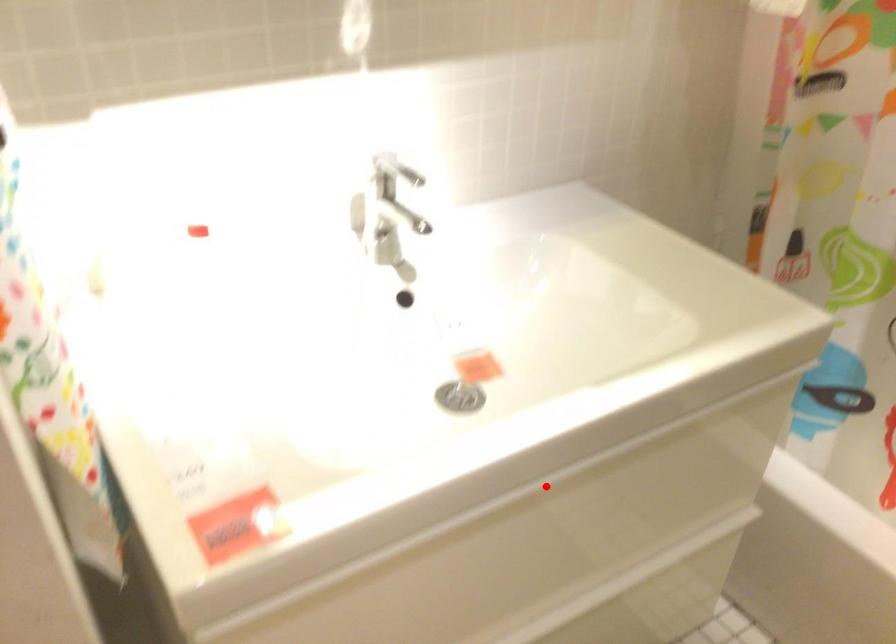
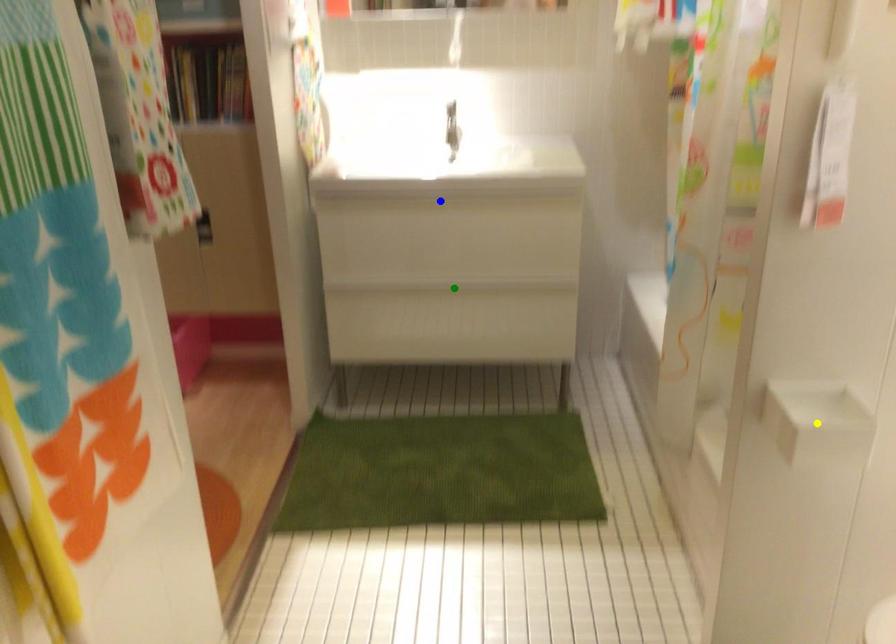
Question: I am providing you with two images of the same scene from different viewpoints. A red point is marked on the first image. You are given multiple points on the second image. In image 2, which mark is for the same physical point as the one in image 1?

Choices:
 (A) green point
 (B) blue point
 (C) yellow point

Answer: (B)